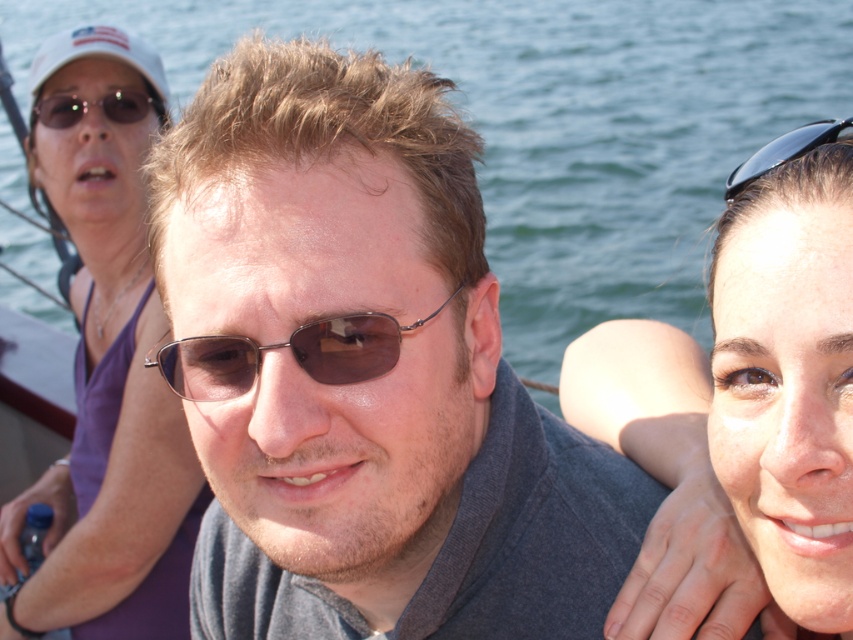
You are a photographer standing at the center of the scene. You want to take a photo that includes both the black plastic sunglasses at upper right and the matte black sunglasses at upper left. Given that your camera has a maximum angle of view of 60 degrees, can you capture both objects in a single frame without moving?

The black plastic sunglasses at upper right and matte black sunglasses at upper left are 2.70 meters apart. Assuming the photographer is at the center, the distance between the two objects would require an angle wider than 60 degrees to capture both, so it might not be possible without moving.

You are a photographer trying to capture a closeup of the purple fabric top at upper left and the matte black sunglasses at upper left. Since you want to focus on both objects, which one should you adjust your camera to prioritize focusing on first based on their positions?

The purple fabric top at upper left is positioned on the left side of matte black sunglasses at upper left. Therefore, you should prioritize focusing on the purple fabric top at upper left first as it is closer to the left edge of the frame, ensuring both are in focus by adjusting focus between them.

You are standing at the point marked as point (100, 109). You want to throw a ball to a friend who is 4.0 meters away from you. Is your friend within reach?

The distance of point (100, 109) from viewer is 3.60 meters, so if your friend is 4.0 meters away from you, they are slightly beyond your current position but within a reasonable throwing distance. However, the exact reach depends on your throwing strength.